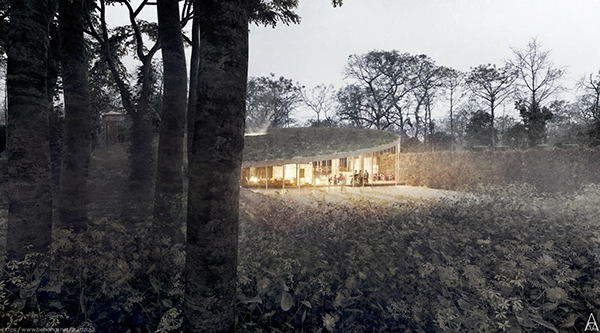
Identify the location of pillars. The width and height of the screenshot is (600, 333). (298, 171), (313, 170), (331, 168), (357, 165), (368, 163), (378, 163).